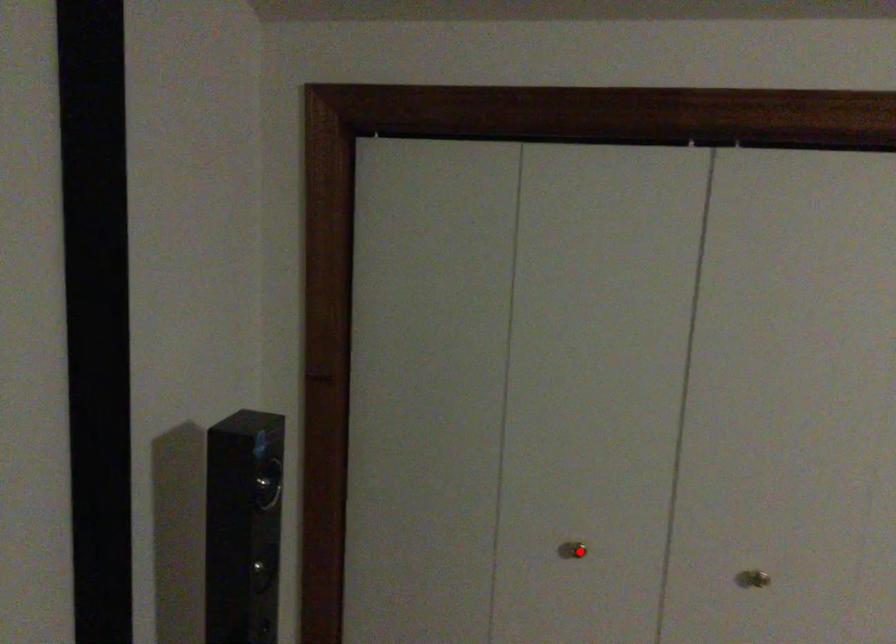
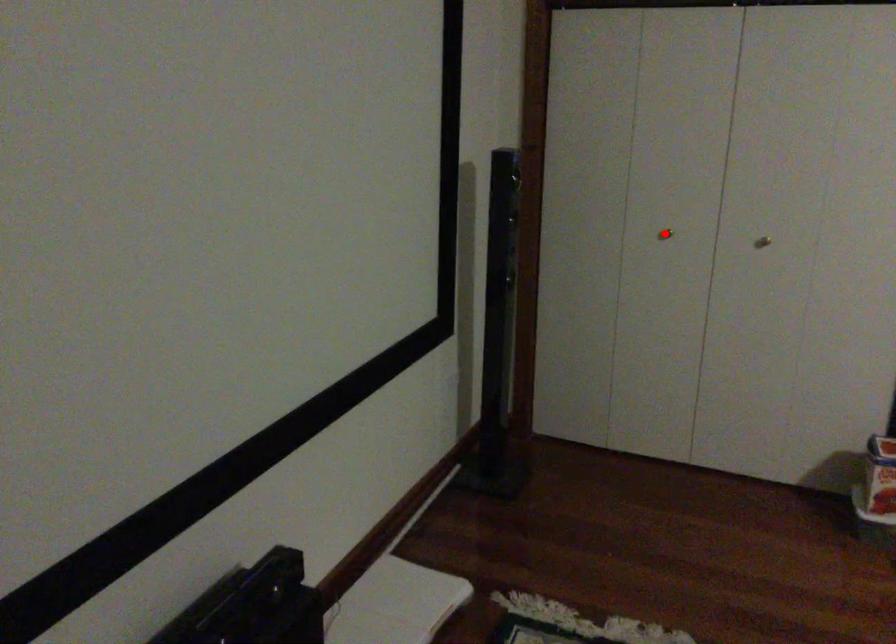
I am providing you with two images of the same scene from different viewpoints. A red point is marked on the first image and another point is marked on the second image. Is the marked point in image1 the same physical position as the marked point in image2?

Yes